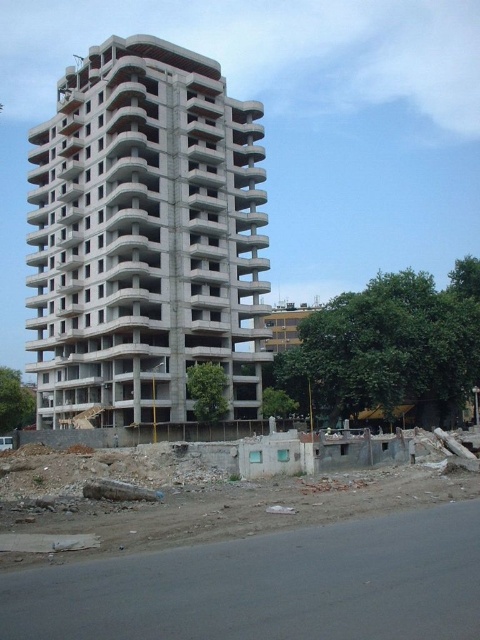
Is concrete rubble at lower center below concrete building at center?

Yes, concrete rubble at lower center is below concrete building at center.

Does point (133, 632) come in front of point (146, 250)?

Yes, it is in front of point (146, 250).

Which is behind, point (402, 589) or point (105, 70)?

The point (105, 70) is behind.

Image resolution: width=480 pixels, height=640 pixels. In order to click on concrete rubble at lower center in this screenshot , I will do `click(240, 547)`.